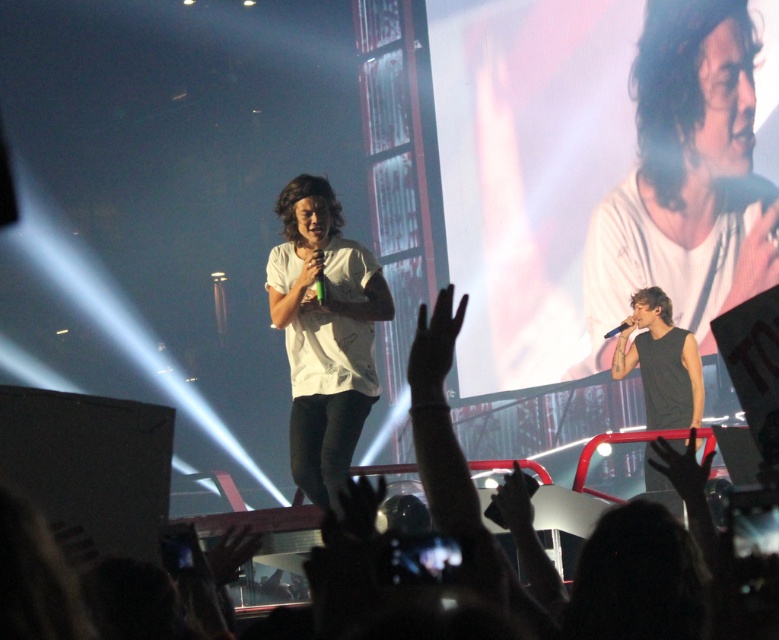
Question: Which point is farther to the camera?

Choices:
 (A) (314, 253)
 (B) (326, 356)
 (C) (661, 344)

Answer: (C)

Question: Which point is closer to the camera?

Choices:
 (A) (411, 348)
 (B) (354, 275)
 (C) (312, 256)
 (D) (654, 236)

Answer: (A)

Question: Is black matte hand at center smaller than matte white microphone at center?

Choices:
 (A) yes
 (B) no

Answer: (B)

Question: Is black matte hand at center to the right of matte white microphone at center from the viewer's perspective?

Choices:
 (A) no
 (B) yes

Answer: (B)

Question: Observing the image, what is the correct spatial positioning of matte white microphone at center in reference to black plastic microphone at upper right?

Choices:
 (A) left
 (B) right

Answer: (A)

Question: Among these objects, which one is nearest to the camera?

Choices:
 (A) white matte t-shirt at center
 (B) transparent plastic glove at lower right
 (C) white matte shirt at upper right
 (D) matte white microphone at center

Answer: (B)